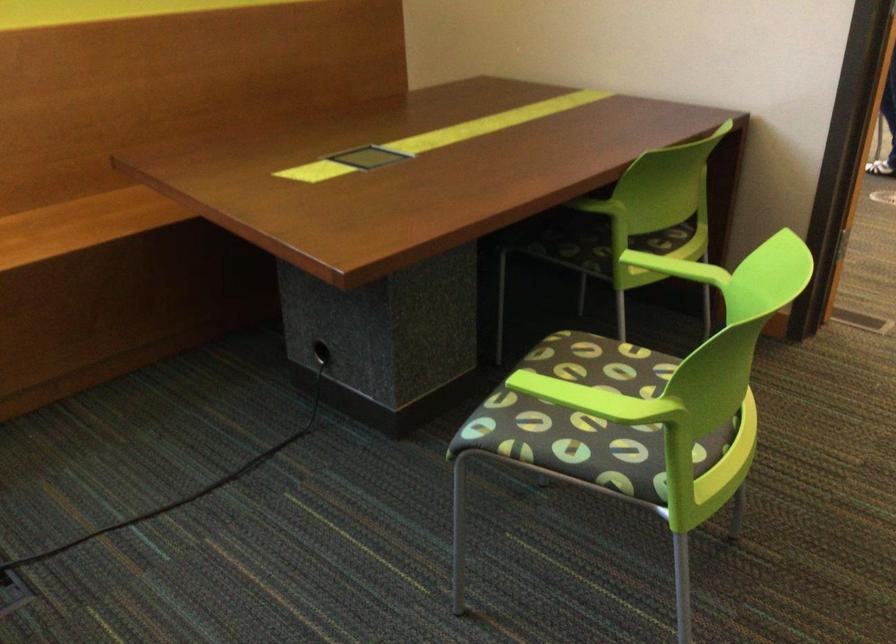
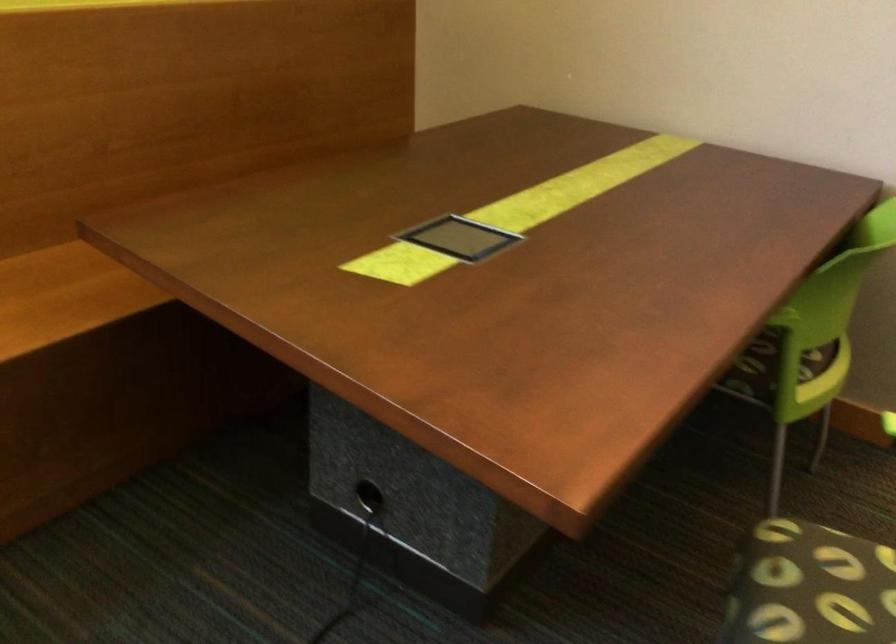
What movement of the cameraman would produce the second image?

The cameraman moved toward left, forward.